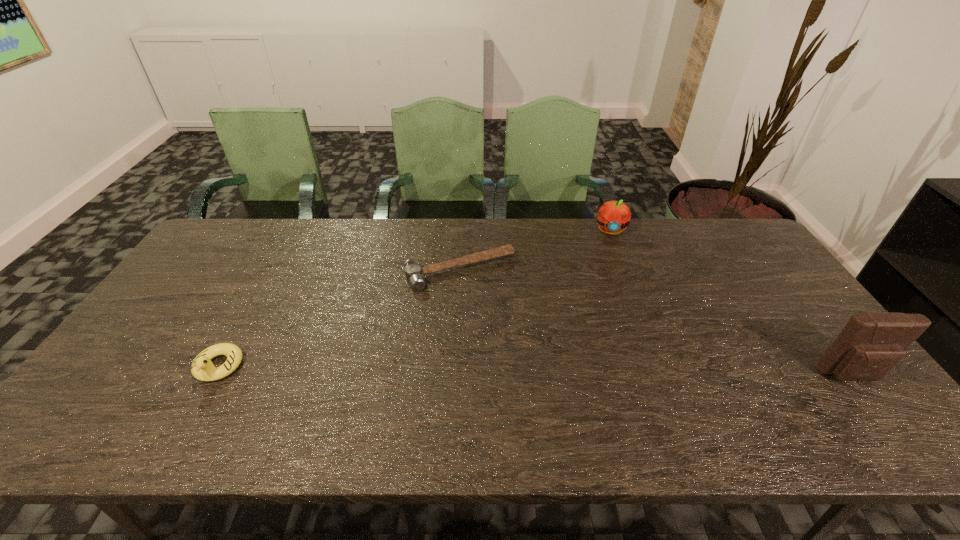
Find the location of `blank space at the far edge of the desktop`. blank space at the far edge of the desktop is located at coordinates (365, 244).

In the image, there is a desktop. At what (x,y) coordinates should I click in order to perform the action: click on vacant space at the near edge. Please return your answer as a coordinate pair (x, y). Looking at the image, I should click on (278, 389).

Where is `free space at the left edge`? Image resolution: width=960 pixels, height=540 pixels. free space at the left edge is located at coordinates (222, 296).

Where is `vacant space at the right edge`? This screenshot has height=540, width=960. vacant space at the right edge is located at coordinates (724, 273).

In the image, there is a desktop. Identify the location of vacant space at the far left corner. (204, 255).

Where is `vacant area that lies between the third object from right to left and the rightmost object`? This screenshot has width=960, height=540. vacant area that lies between the third object from right to left and the rightmost object is located at coordinates (656, 323).

You are a GUI agent. You are given a task and a screenshot of the screen. Output one action in this format:
    pyautogui.click(x=<x>, y=<y>)
    Task: Click on the free space between the third object from right to left and the leftmost object
    This screenshot has height=540, width=960.
    Given the screenshot: What is the action you would take?
    pyautogui.click(x=339, y=319)

Identify the location of vacant area that lies between the third object from left to right and the duckling. (414, 299).

At what (x,y) coordinates should I click in order to perform the action: click on free spot between the leftmost object and the tallest object. Please return your answer as a coordinate pair (x, y). This screenshot has height=540, width=960. Looking at the image, I should click on (535, 371).

Where is `free space between the pouch and the second tallest object`? This screenshot has height=540, width=960. free space between the pouch and the second tallest object is located at coordinates (731, 303).